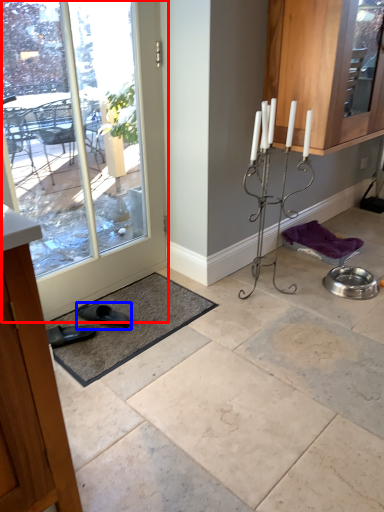
Question: Which object is closer to the camera taking this photo, door (highlighted by a red box) or footwear (highlighted by a blue box)?

Choices:
 (A) door
 (B) footwear

Answer: (A)